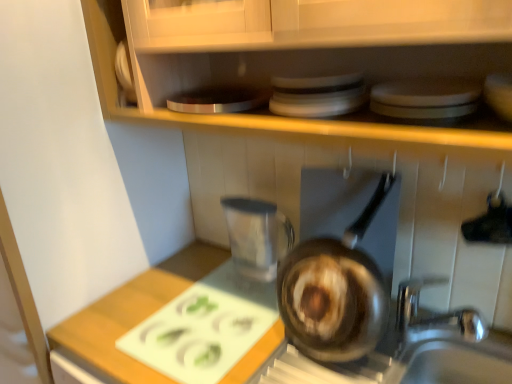
Question: From a real-world perspective, is white glossy plates at upper center above or below shiny brown frying pan at center?

Choices:
 (A) above
 (B) below

Answer: (A)

Question: Looking at the image, does white glossy plates at upper center seem bigger or smaller compared to shiny brown frying pan at center?

Choices:
 (A) big
 (B) small

Answer: (B)

Question: Which of these objects is positioned farthest from the white cutting board at center?

Choices:
 (A) white glossy plates at upper center
 (B) shiny brown frying pan at center

Answer: (A)

Question: Estimate the real-world distances between objects in this image. Which object is farther from the white cutting board at center?

Choices:
 (A) shiny brown frying pan at center
 (B) white glossy plates at upper center

Answer: (B)